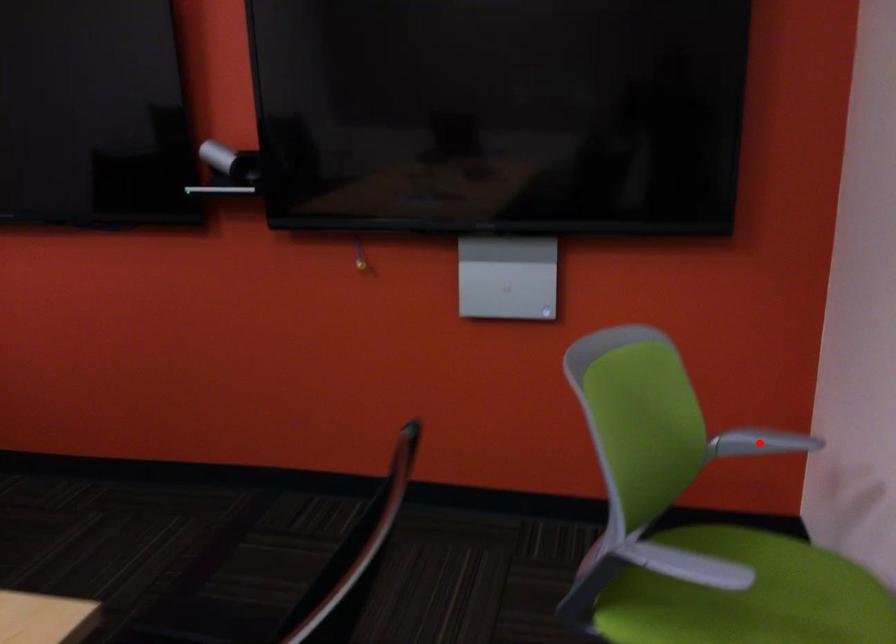
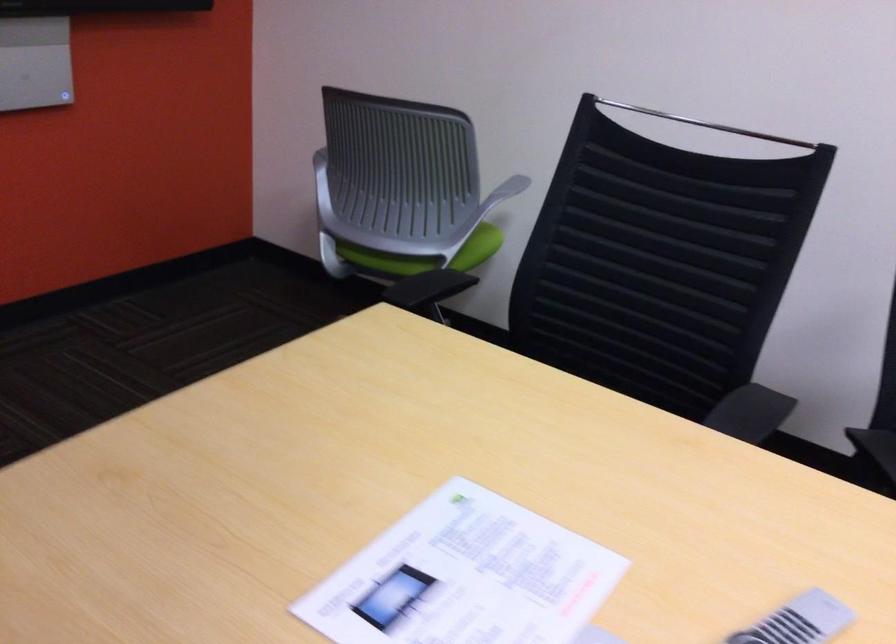
Question: I am providing you with two images of the same scene from different viewpoints. A red point is marked on the first image. Is the red point's position out of view in image 2?

Choices:
 (A) Yes
 (B) No

Answer: (A)